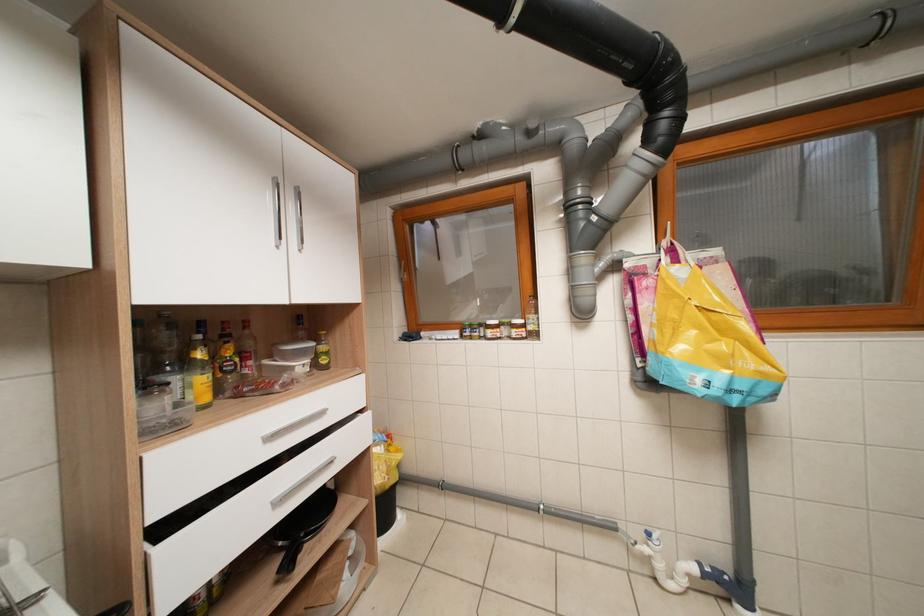
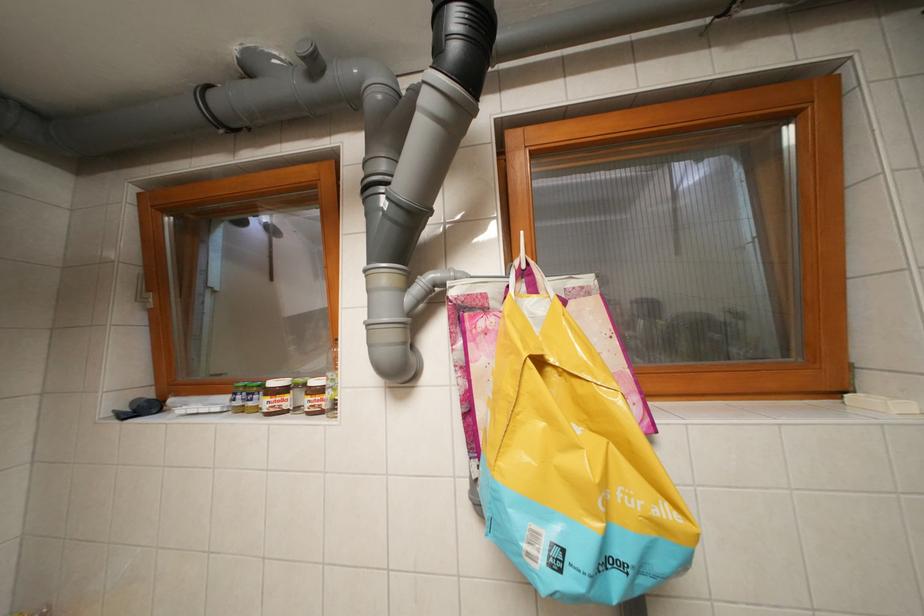
Question: Based on the continuous images, in which direction is the camera rotating? Reply with the corresponding letter.

Choices:
 (A) Left
 (B) Right
 (C) Up
 (D) Down

Answer: (B)